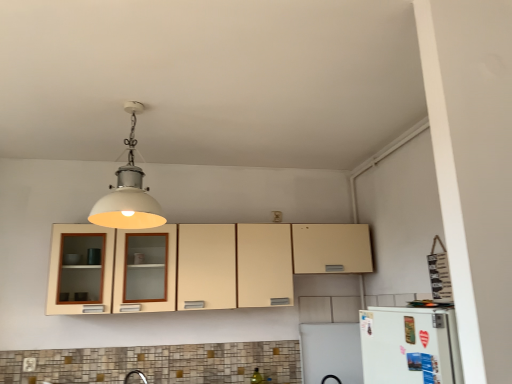
Question: Does white matte light fixture at upper center have a greater width compared to beige matte cabinet at center?

Choices:
 (A) yes
 (B) no

Answer: (A)

Question: Can we say white matte light fixture at upper center lies outside beige matte cabinet at center?

Choices:
 (A) no
 (B) yes

Answer: (B)

Question: From a real-world perspective, is white matte light fixture at upper center on top of beige matte cabinet at center?

Choices:
 (A) no
 (B) yes

Answer: (B)

Question: Is white matte light fixture at upper center aimed at beige matte cabinet at center?

Choices:
 (A) yes
 (B) no

Answer: (B)

Question: Is white matte light fixture at upper center positioned before beige matte cabinet at center?

Choices:
 (A) no
 (B) yes

Answer: (B)

Question: Is white matte light fixture at upper center shorter than beige matte cabinet at center?

Choices:
 (A) no
 (B) yes

Answer: (A)

Question: From the image's perspective, is white matte refrigerator at lower right on matte white electric outlet at lower left?

Choices:
 (A) yes
 (B) no

Answer: (A)

Question: From a real-world perspective, does white matte refrigerator at lower right sit lower than matte white electric outlet at lower left?

Choices:
 (A) no
 (B) yes

Answer: (A)

Question: Could you tell me if white matte refrigerator at lower right is turned towards matte white electric outlet at lower left?

Choices:
 (A) no
 (B) yes

Answer: (A)

Question: Is the position of white matte refrigerator at lower right less distant than that of matte white electric outlet at lower left?

Choices:
 (A) no
 (B) yes

Answer: (B)

Question: Is white matte refrigerator at lower right at the left side of matte white electric outlet at lower left?

Choices:
 (A) no
 (B) yes

Answer: (A)

Question: Is white matte refrigerator at lower right thinner than matte white electric outlet at lower left?

Choices:
 (A) no
 (B) yes

Answer: (B)

Question: Is white matte light fixture at upper center to the left of white matte refrigerator at lower right from the viewer's perspective?

Choices:
 (A) yes
 (B) no

Answer: (A)